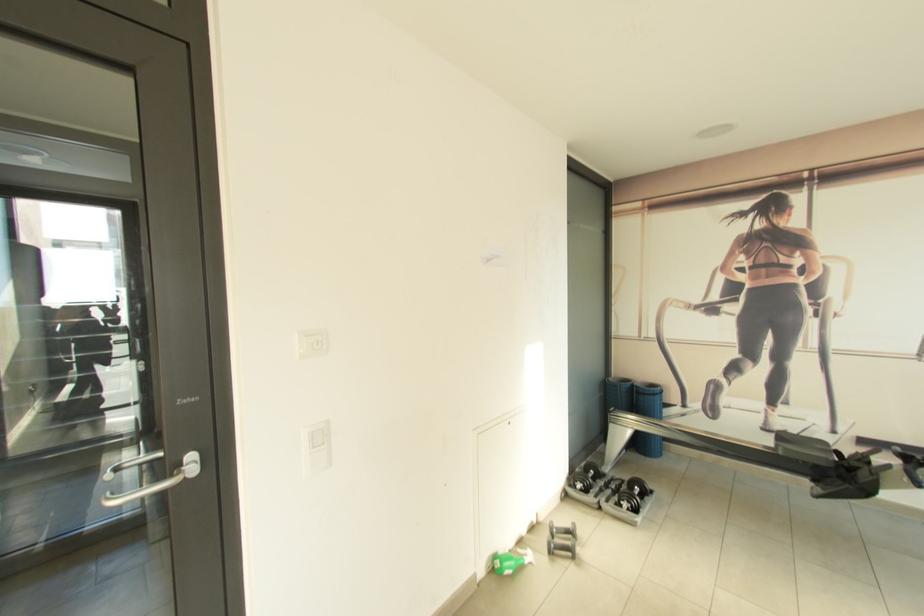
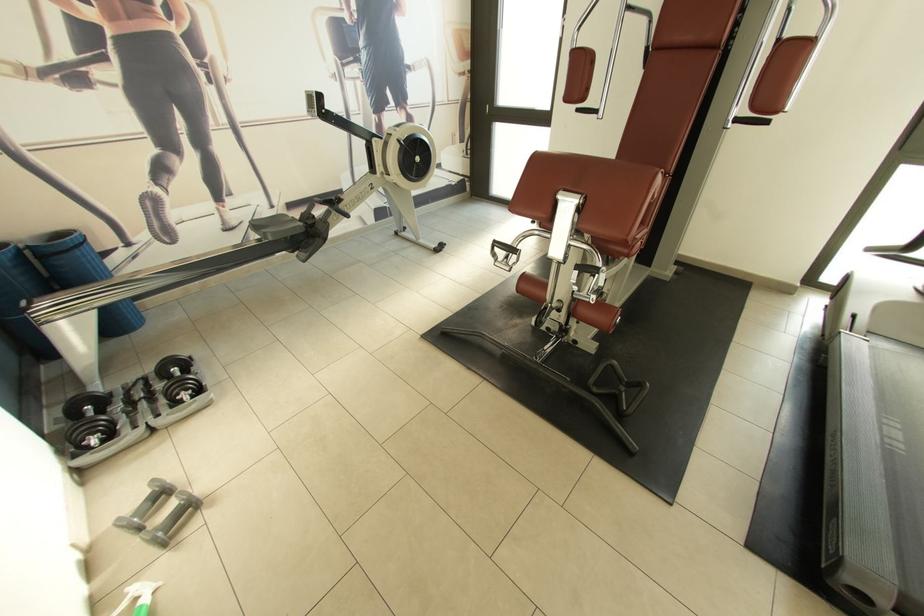
Find the pixel in the second image that matches point (600, 479) in the first image.

(106, 413)